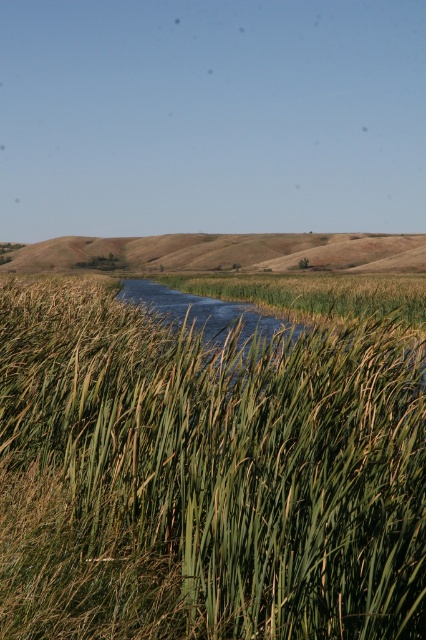
You are standing at the edge of the winding river and notice two areas in the scene. One is the green grassy at center and the other is the brown grassy hillside at center. Which of these two areas is positioned to the right when viewed from your current position?

The green grassy at center is positioned to the right of the brown grassy hillside at center.

You are a hiker trying to cross the river. You see the green grassy at center and the brown grassy hillside at center. Which area would you choose to cross the river if you want to take the path with more vegetation coverage?

The brown grassy hillside at center occupies more space than the green grassy at center, so you should choose the brown grassy hillside at center for crossing the river as it has more vegetation coverage.

You are standing at the point marked by the coordinates point (x=218, y=470) in the image. Looking around, what is the primary color of the area you are currently standing in?

The point (x=218, y=470) marks green grassy at center, so the primary color of the area you are currently standing in is green.